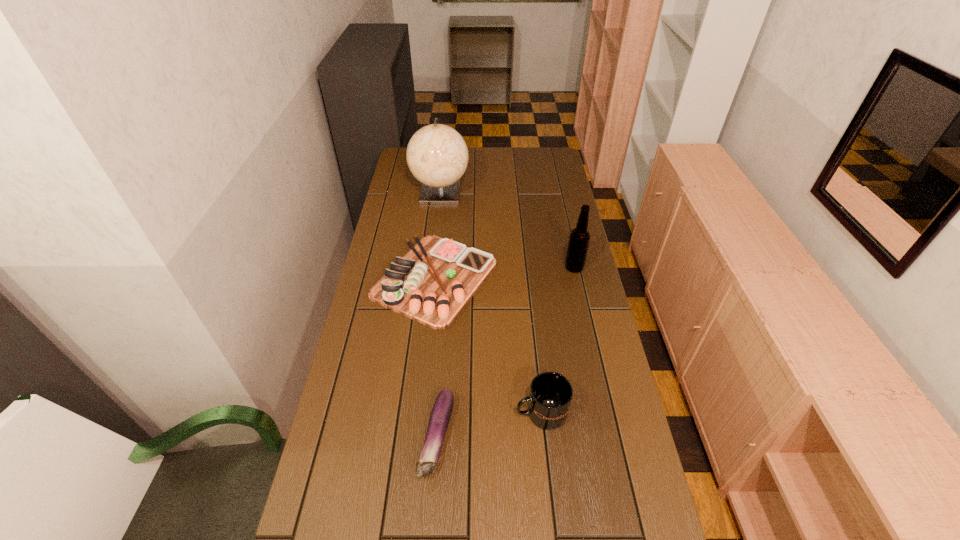
Locate an element on the screen. The height and width of the screenshot is (540, 960). the tallest object is located at coordinates (437, 155).

The image size is (960, 540). Find the location of `the farthest object`. the farthest object is located at coordinates (437, 155).

This screenshot has height=540, width=960. Identify the location of the rightmost object. click(x=579, y=239).

This screenshot has height=540, width=960. What are the coordinates of `beer bottle` in the screenshot? It's located at (579, 239).

Where is `the fourth object from left to right`? The width and height of the screenshot is (960, 540). the fourth object from left to right is located at coordinates (551, 393).

The width and height of the screenshot is (960, 540). What are the coordinates of `mug` in the screenshot? It's located at (551, 393).

Find the location of a particular element. The image size is (960, 540). platter is located at coordinates (431, 284).

I want to click on eggplant, so click(441, 412).

Locate an element on the screen. free space located 0.120m on the surface of the farthest object showing Europe and Africa is located at coordinates (436, 228).

Where is `vacant space located on the left of the rightmost object`? This screenshot has height=540, width=960. vacant space located on the left of the rightmost object is located at coordinates (495, 267).